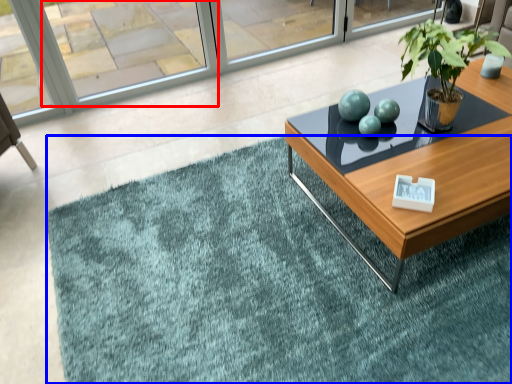
Question: Which object is closer to the camera taking this photo, window (highlighted by a red box) or doormat (highlighted by a blue box)?

Choices:
 (A) window
 (B) doormat

Answer: (B)